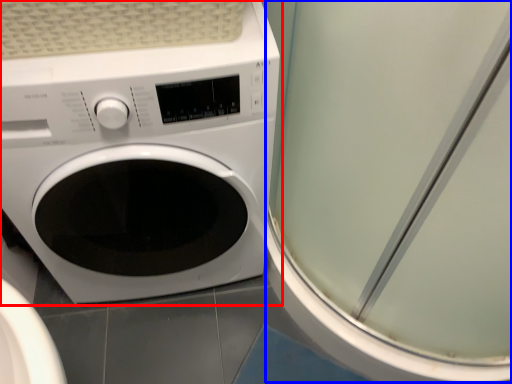
Question: Which point is closer to the camera, washing machine (highlighted by a red box) or screen door (highlighted by a blue box)?

Choices:
 (A) washing machine
 (B) screen door

Answer: (B)